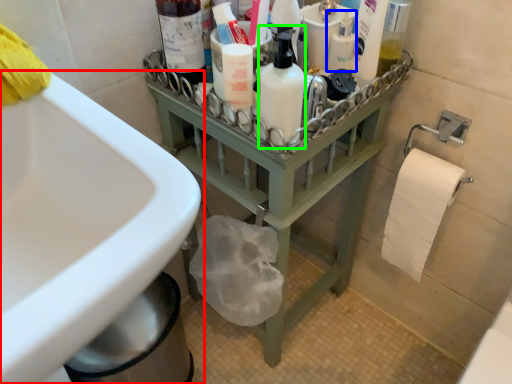
Question: Which object is the farthest from sink (highlighted by a red box)? Choose among these: mouthwash (highlighted by a blue box) or cleaning product (highlighted by a green box).

Choices:
 (A) mouthwash
 (B) cleaning product

Answer: (A)